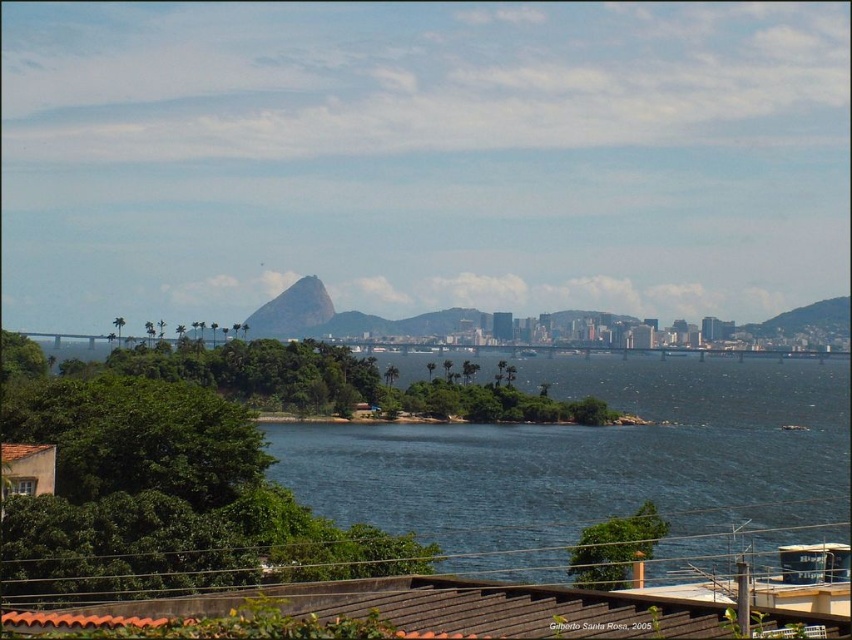
Question: Does blue water at center have a greater width compared to green rough rock at center?

Choices:
 (A) no
 (B) yes

Answer: (B)

Question: Is blue water at center wider than green rough rock at center?

Choices:
 (A) no
 (B) yes

Answer: (B)

Question: Which object is farther from the camera taking this photo?

Choices:
 (A) blue water at center
 (B) green rough rock at center

Answer: (B)

Question: Where is blue water at center located in relation to green rough rock at center in the image?

Choices:
 (A) right
 (B) left

Answer: (A)